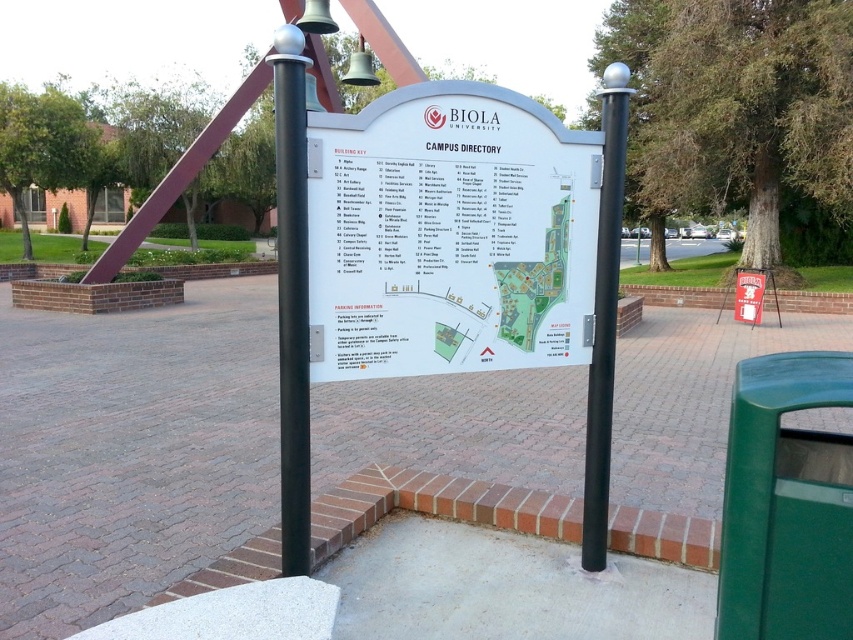
Question: Among these points, which one is farthest from the camera?

Choices:
 (A) (619, 168)
 (B) (303, 337)

Answer: (A)

Question: Which point appears farthest from the camera in this image?

Choices:
 (A) (317, 378)
 (B) (282, 349)
 (C) (602, 541)

Answer: (C)

Question: Can you confirm if white plastic sign at center is thinner than black polished metal pole at center?

Choices:
 (A) yes
 (B) no

Answer: (B)

Question: Which object appears closest to the camera in this image?

Choices:
 (A) black polished metal pole at center
 (B) white plastic sign at center

Answer: (B)

Question: Can you confirm if white plastic sign at center is thinner than black metal pole at right?

Choices:
 (A) no
 (B) yes

Answer: (A)

Question: In this image, where is black polished metal pole at center located relative to black metal pole at right?

Choices:
 (A) below
 (B) above

Answer: (A)